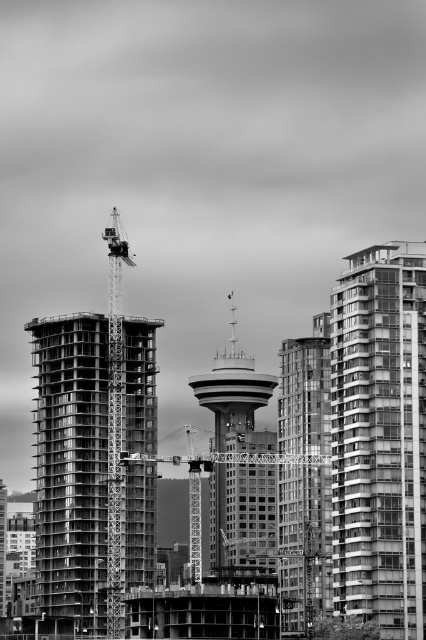
Question: Among these points, which one is nearest to the camera?

Choices:
 (A) (412, 582)
 (B) (137, 458)
 (C) (161, 324)
 (D) (279, 433)

Answer: (A)

Question: Can you confirm if concrete construction at center is thinner than smooth glass building at center?

Choices:
 (A) no
 (B) yes

Answer: (A)

Question: Observing the image, what is the correct spatial positioning of smooth glass building at center in reference to metallic construction crane at center?

Choices:
 (A) left
 (B) right

Answer: (B)

Question: Estimate the real-world distances between objects in this image. Which object is farther from the metallic construction crane at center?

Choices:
 (A) glassy reflective building at right
 (B) concrete construction at center

Answer: (A)

Question: Among these objects, which one is farthest from the camera?

Choices:
 (A) metallic construction crane at center
 (B) smooth concrete tower at center

Answer: (B)

Question: Can you confirm if glassy reflective building at right is positioned above smooth glass building at center?

Choices:
 (A) no
 (B) yes

Answer: (B)